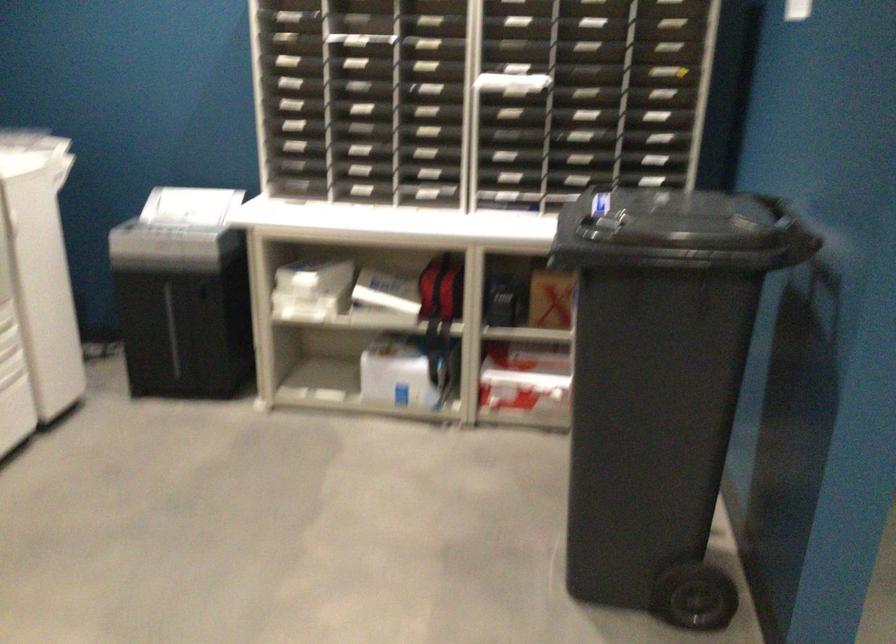
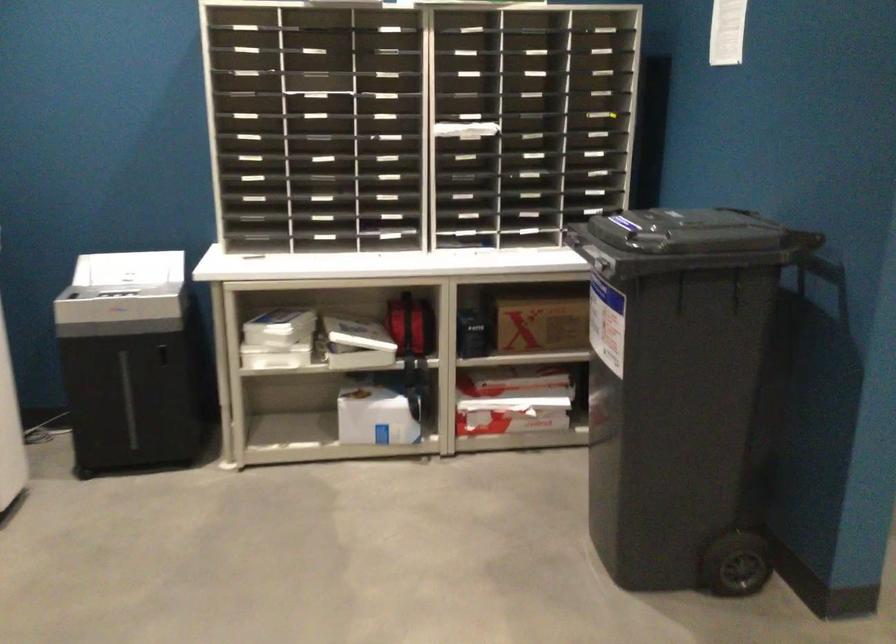
Question: The first image is from the beginning of the video and the second image is from the end. How did the camera likely rotate when shooting the video?

Choices:
 (A) Left
 (B) Right
 (C) Up
 (D) Down

Answer: (B)